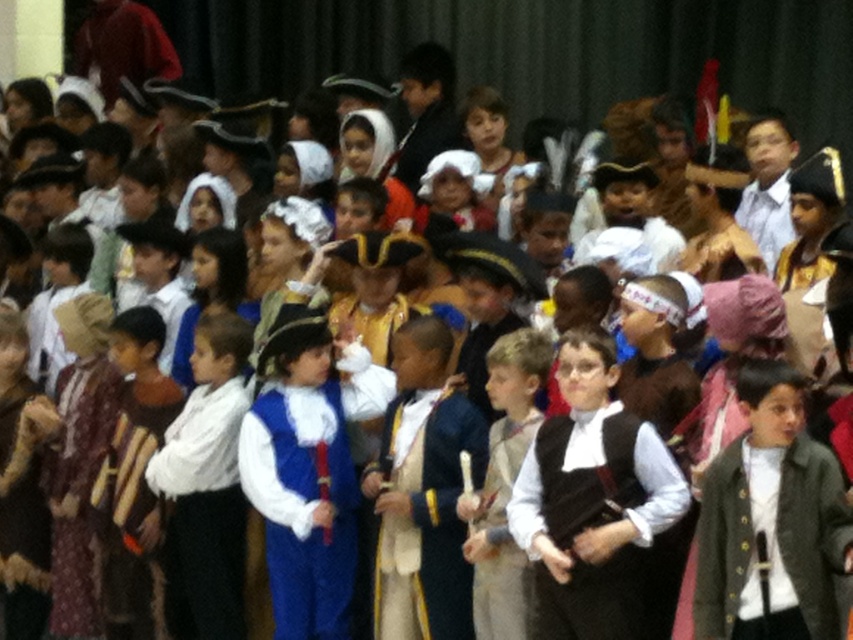
Question: Which point is farther to the camera?

Choices:
 (A) (556, 509)
 (B) (335, 440)
 (C) (737, 602)

Answer: (B)

Question: Estimate the real-world distances between objects in this image. Which object is closer to the light brown fabric vest at center?

Choices:
 (A) velvet blue coat at center
 (B) matte black vest at center

Answer: (A)

Question: Is matte black vest at center wider than light brown fabric vest at center?

Choices:
 (A) no
 (B) yes

Answer: (B)

Question: Can you confirm if matte black vest at center is smaller than blue velvet vest at center?

Choices:
 (A) no
 (B) yes

Answer: (B)

Question: From the image, what is the correct spatial relationship of matte black vest at center in relation to gray wool coat at center?

Choices:
 (A) left
 (B) right

Answer: (A)

Question: Based on their relative distances, which object is farther from the blue velvet vest at center?

Choices:
 (A) velvet blue coat at center
 (B) light brown fabric vest at center

Answer: (B)